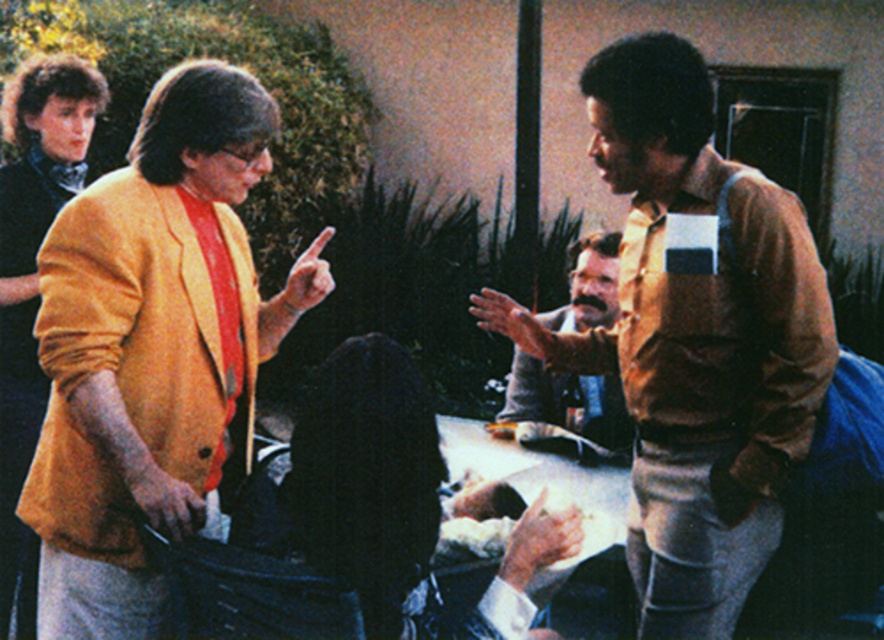
Consider the image. You are a photographer trying to capture a candid shot of the black fabric jacket at center and the bearded man at center. Since you want to focus on their faces, which object should you adjust your camera to focus on first based on their height?

Result: The black fabric jacket at center is shorter than bearded man at center, so you should focus on the bearded man at center first since he is taller and his face would be at a higher position.

You are a photographer trying to capture a candid shot of the matte yellow jacket at left and the matte yellow sweater at upper left. Since you want to focus on the jacket, should you adjust your camera to focus on the foreground or background?

The matte yellow jacket at left is in front of the matte yellow sweater at upper left, so to focus on the jacket, you should adjust your camera to focus on the foreground.

Based on the coordinates provided, which object in the scene is located at point (362, 483)?

The point (362, 483) corresponds to the black fabric jacket at center.